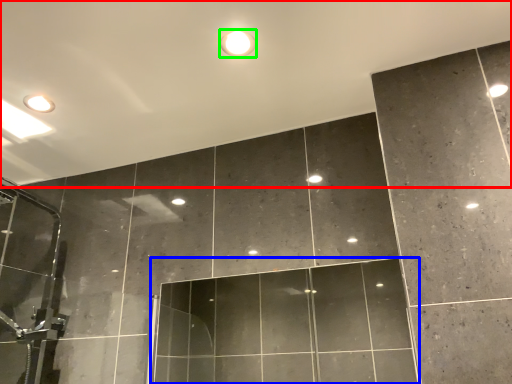
Question: Which is farther away from backdrop (highlighted by a red box)? glass door (highlighted by a blue box) or droplight (highlighted by a green box)?

Choices:
 (A) glass door
 (B) droplight

Answer: (A)